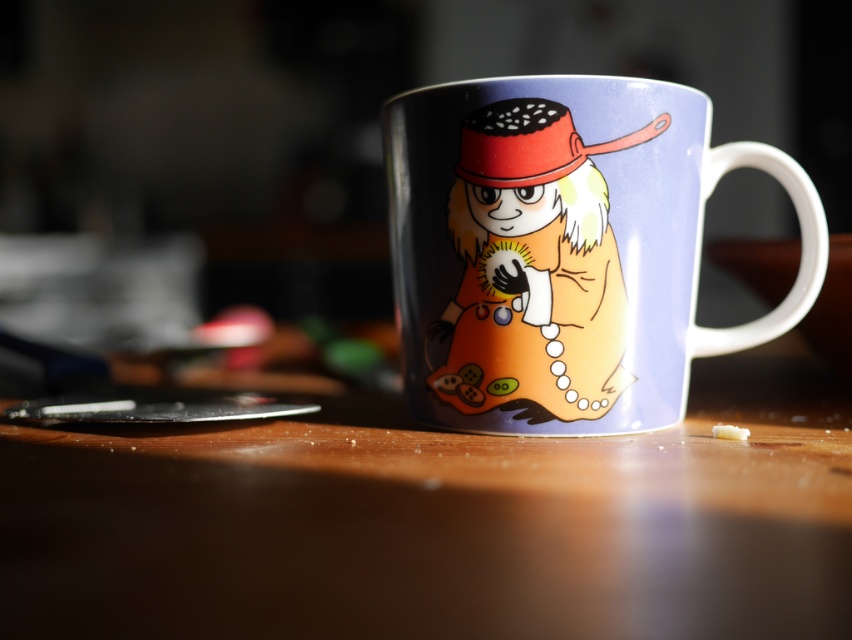
Question: Is wooden table at center thinner than glossy ceramic mug at center?

Choices:
 (A) no
 (B) yes

Answer: (A)

Question: Is wooden table at center to the left of glossy ceramic mug at center from the viewer's perspective?

Choices:
 (A) yes
 (B) no

Answer: (A)

Question: Which point appears closest to the camera in this image?

Choices:
 (A) (461, 129)
 (B) (640, 618)

Answer: (B)

Question: Can you confirm if wooden table at center is positioned to the right of glossy ceramic mug at center?

Choices:
 (A) yes
 (B) no

Answer: (B)